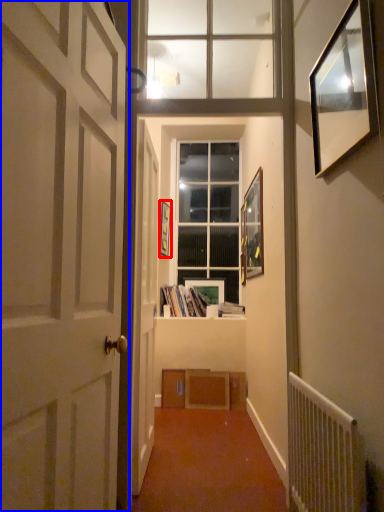
Question: Among these objects, which one is nearest to the camera, picture frame (highlighted by a red box) or door (highlighted by a blue box)?

Choices:
 (A) picture frame
 (B) door

Answer: (B)